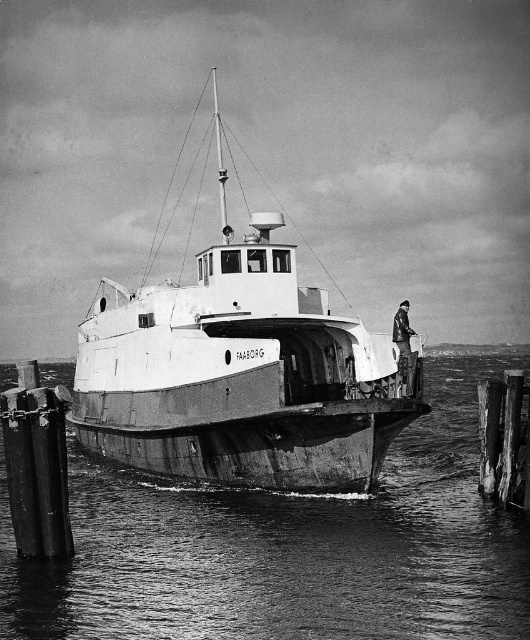
Question: Which object is the farthest from the smooth water at center?

Choices:
 (A) weathered wood post at lower right
 (B) white matte boat at center

Answer: (A)

Question: Does smooth water at center have a smaller size compared to white matte boat at center?

Choices:
 (A) no
 (B) yes

Answer: (B)

Question: Which object is closer to the camera taking this photo?

Choices:
 (A) white matte boat at center
 (B) smooth water at center
 (C) smooth wood post at lower left

Answer: (B)

Question: Which point appears farthest from the camera in this image?

Choices:
 (A) (234, 634)
 (B) (413, 368)
 (C) (295, 481)
 (D) (488, 385)

Answer: (D)

Question: Is smooth water at center bigger than white matte boat at center?

Choices:
 (A) yes
 (B) no

Answer: (B)

Question: Can you confirm if smooth wood post at lower left is positioned to the left of weathered wood post at lower right?

Choices:
 (A) no
 (B) yes

Answer: (B)